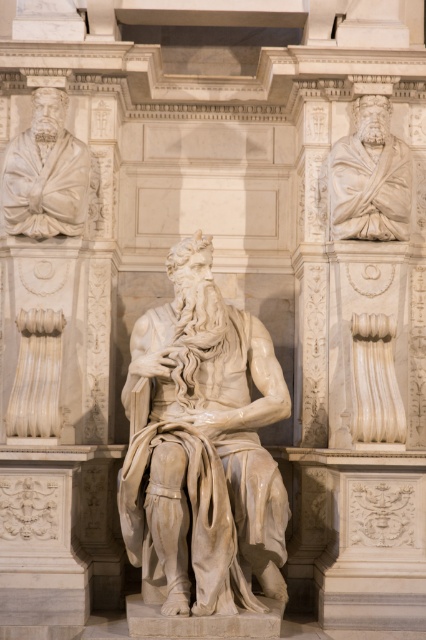
Consider the image. You are an art student standing in front of the sculpture. You want to take a photo of both the white marble statue at center and the white marble statue at upper left. Which statue should you focus on first to ensure both are in the frame?

You should focus on the white marble statue at center first because it is closer to you, so adjusting the camera to include it will naturally include the white marble statue at upper left which is further away.